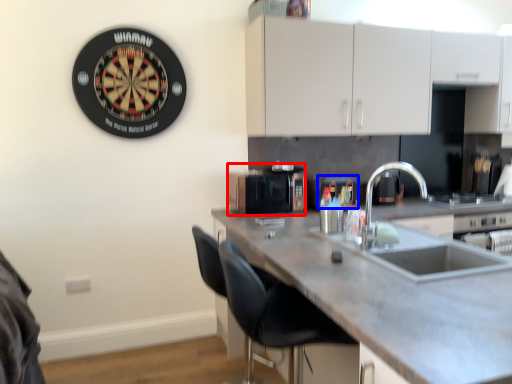
Question: Which object appears farthest to the camera in this image, appliance (highlighted by a red box) or appliance (highlighted by a blue box)?

Choices:
 (A) appliance
 (B) appliance

Answer: (B)